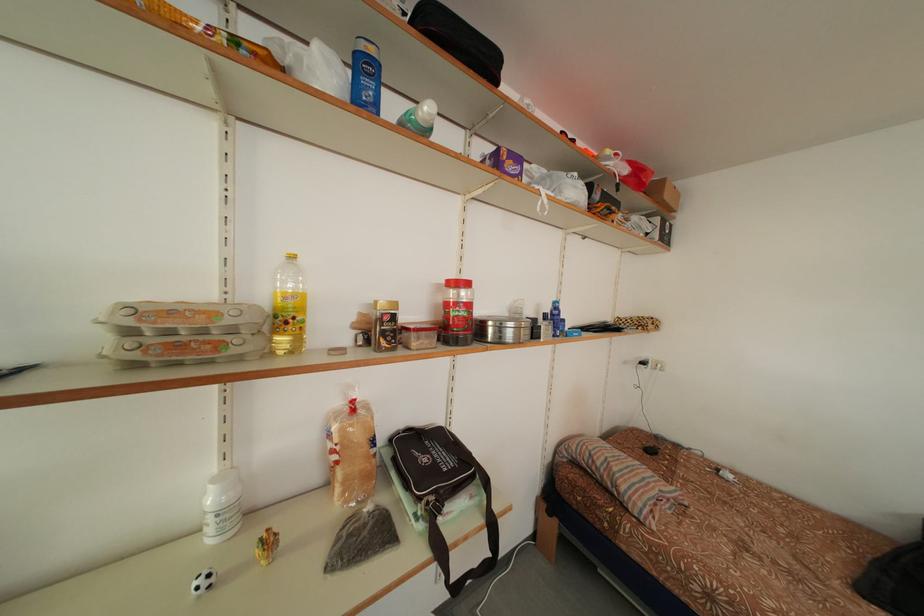
The height and width of the screenshot is (616, 924). In order to click on brown jar lid in this screenshot , I will do coord(502,329).